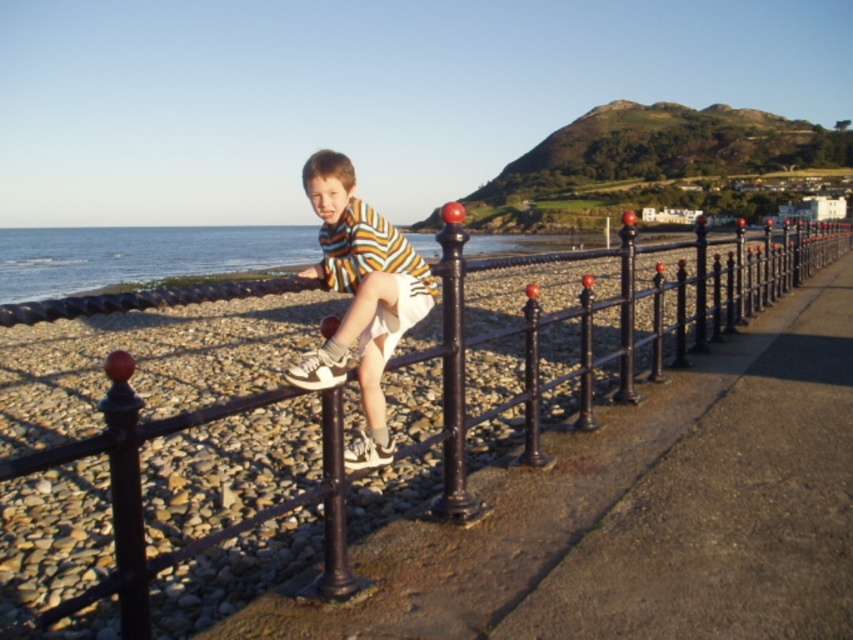
You are a tailor who needs to determine if the striped cotton shirt at center can be hung on the glossy black pole at center. Based on the scene, can the shirt be hung on the pole?

The striped cotton shirt at center is thinner than glossy black pole at center, so it cannot be hung on the pole since the pole is thicker than the shirt.

You are a photographer trying to capture the boy sitting on the black metal railing. The camera you are using has a limited field of view. You need to focus on the boy while ensuring the black wrought iron fence at center is also in the frame. Is the point at coordinates point (653, 310) within the area where both the boy and the fence are visible?

The point at coordinates point (653, 310) corresponds to the black wrought iron fence at center. Since the boy is sitting on the black metal railing and the fence is at the center, the point where the fence is located would be visible along with the boy in the frame.

You are standing at the entrance of the promenade and want to find the black wrought iron fence at center. According to the coordinates provided, in which direction should you walk to reach it?

The black wrought iron fence at center is located at point coordinates, so you should walk towards the center of the image to reach it.